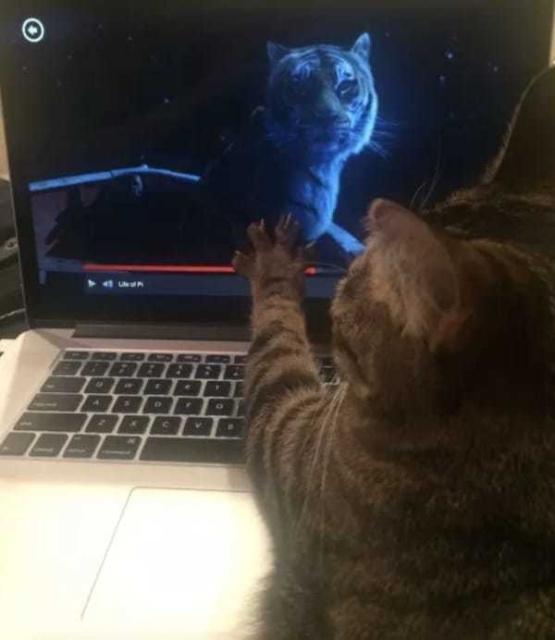
You are a GUI agent. You are given a task and a screenshot of the screen. Output one action in this format:
    pyautogui.click(x=<x>, y=<y>)
    Task: Click on the laptop keyboard
    Image resolution: width=555 pixels, height=640 pixels.
    Given the screenshot: What is the action you would take?
    pyautogui.click(x=82, y=504)